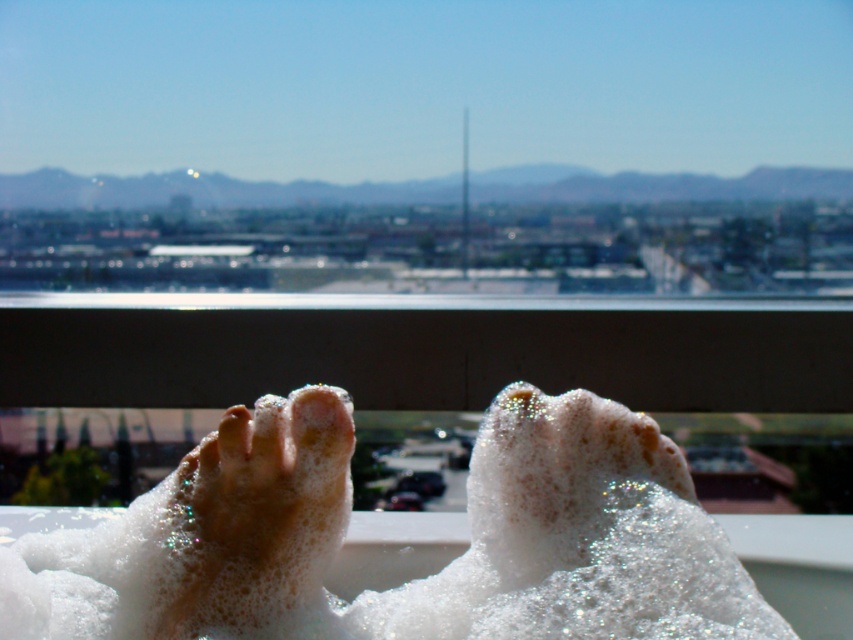
Question: Which point is farther to the camera?

Choices:
 (A) (216, 580)
 (B) (155, 564)
 (C) (248, 451)

Answer: (C)

Question: Can you confirm if frothy white foot at lower left is positioned to the left of smooth skin toe at center?

Choices:
 (A) yes
 (B) no

Answer: (B)

Question: Based on their relative distances, which object is farther from the white foamy feet at lower center?

Choices:
 (A) smooth skin toe at center
 (B) frothy white foot at lower left

Answer: (A)

Question: Is white foamy feet at lower center thinner than smooth skin toe at center?

Choices:
 (A) yes
 (B) no

Answer: (B)

Question: From the image, what is the correct spatial relationship of frothy white foot at lower left in relation to smooth skin toe at center?

Choices:
 (A) below
 (B) above

Answer: (A)

Question: Considering the real-world distances, which object is closest to the smooth skin toe at center?

Choices:
 (A) frothy white foot at lower left
 (B) white foamy feet at lower center

Answer: (A)